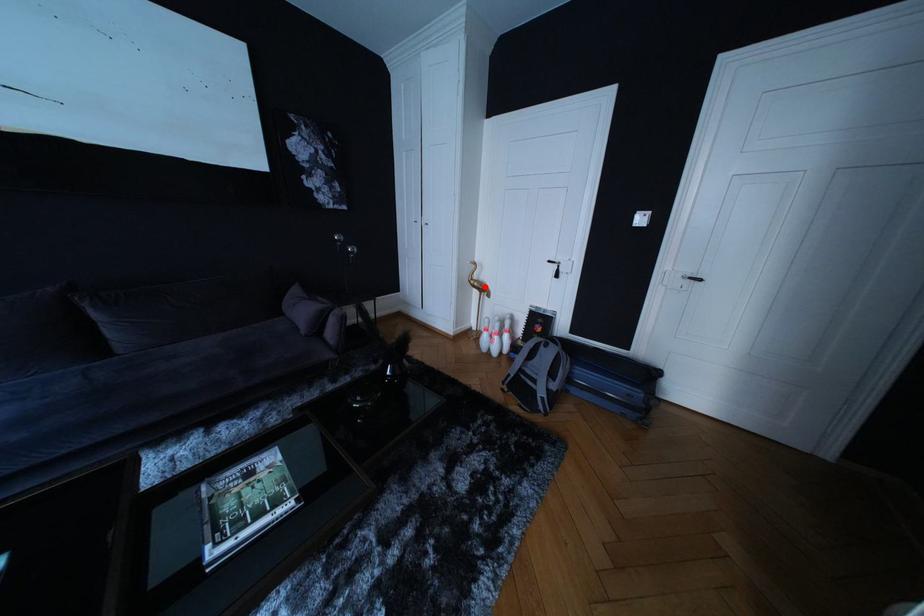
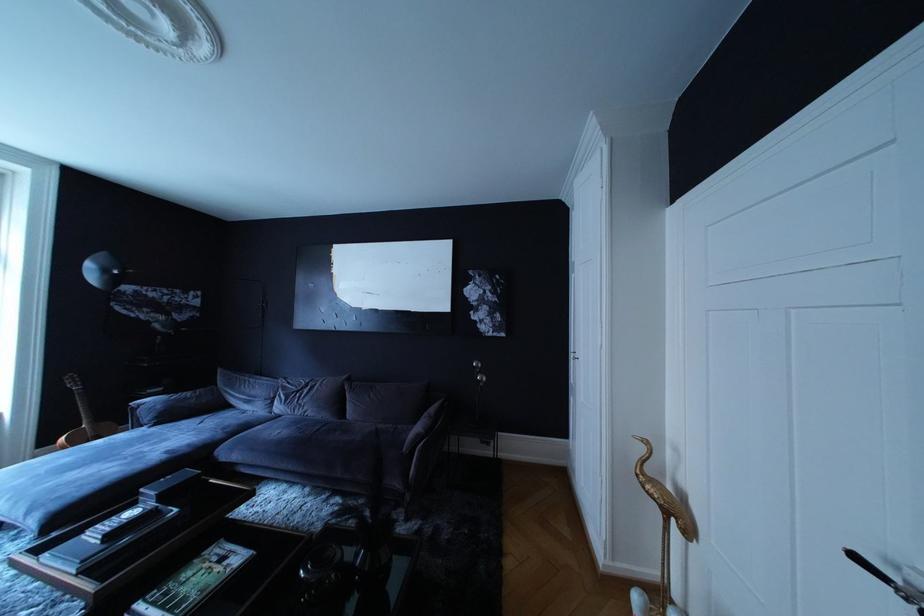
Question: I am providing you with two images of the same scene from different viewpoints. Given a red point in image1, look at the same physical point in image2. Is it:

Choices:
 (A) Closer to the viewpoint
 (B) Farther from the viewpoint

Answer: (B)